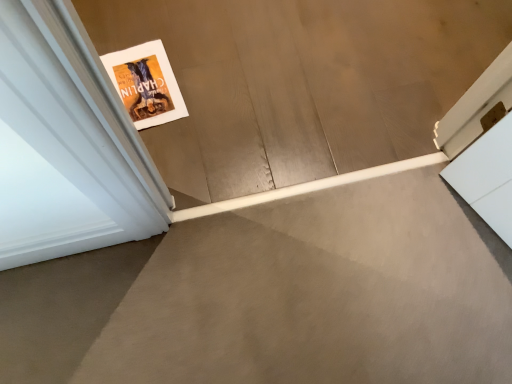
Identify the location of white matte book at lower left. The width and height of the screenshot is (512, 384). (301, 83).

Image resolution: width=512 pixels, height=384 pixels. Describe the element at coordinates (301, 83) in the screenshot. I see `white matte book at lower left` at that location.

Measure the distance between point (x=190, y=50) and camera.

The depth of point (x=190, y=50) is 4.51 feet.

This screenshot has height=384, width=512. Identify the location of white matte book at lower left. (301, 83).